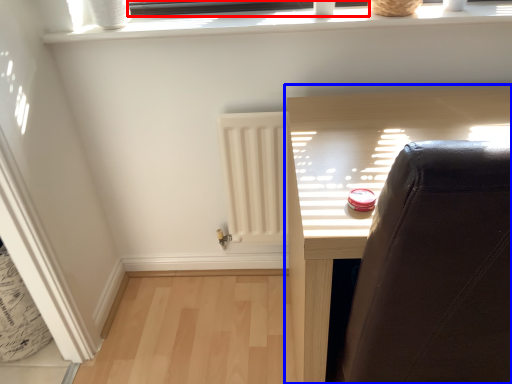
Question: Which object is further to the camera taking this photo, window frame (highlighted by a red box) or furniture (highlighted by a blue box)?

Choices:
 (A) window frame
 (B) furniture

Answer: (A)